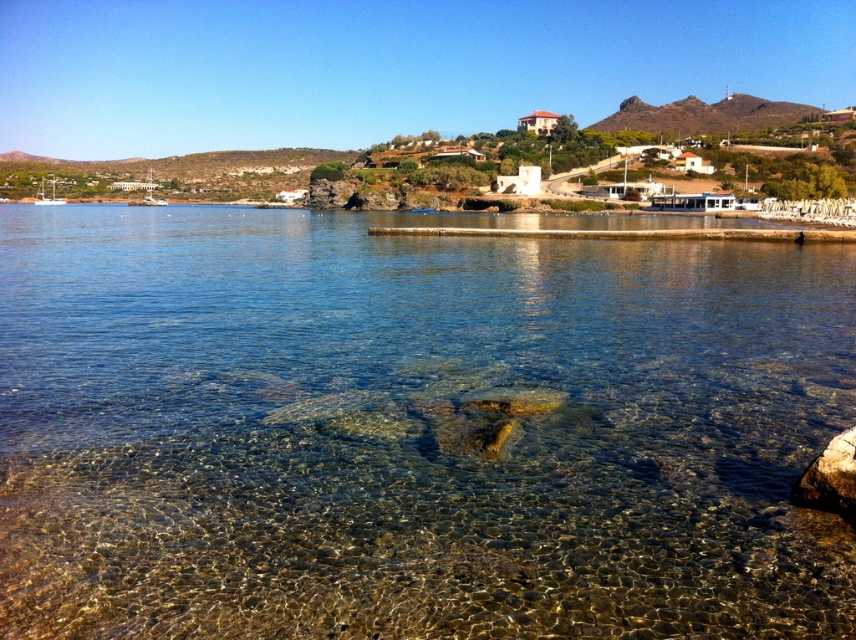
Between brown rocky hill at upper right and brown rough rock at lower right, which one appears on the left side from the viewer's perspective?

brown rough rock at lower right is more to the left.

Which of these two, brown rocky hill at upper right or brown rough rock at lower right, stands taller?

brown rocky hill at upper right

Is point (738, 96) less distant than point (845, 512)?

That is False.

Image resolution: width=856 pixels, height=640 pixels. Find the location of `brown rocky hill at upper right`. brown rocky hill at upper right is located at coordinates (704, 115).

Consider the image. Who is positioned more to the left, clear water at center or brown rough rock at lower right?

clear water at center

Is point (470, 356) behind point (854, 500)?

That is True.

The height and width of the screenshot is (640, 856). Identify the location of clear water at center. (412, 429).

Does clear water at center appear on the right side of brown rocky hill at upper right?

In fact, clear water at center is to the left of brown rocky hill at upper right.

Between point (254, 250) and point (646, 106), which one is positioned in front?

Positioned in front is point (254, 250).

At what (x,y) coordinates should I click in order to perform the action: click on clear water at center. Please return your answer as a coordinate pair (x, y). Looking at the image, I should click on (412, 429).